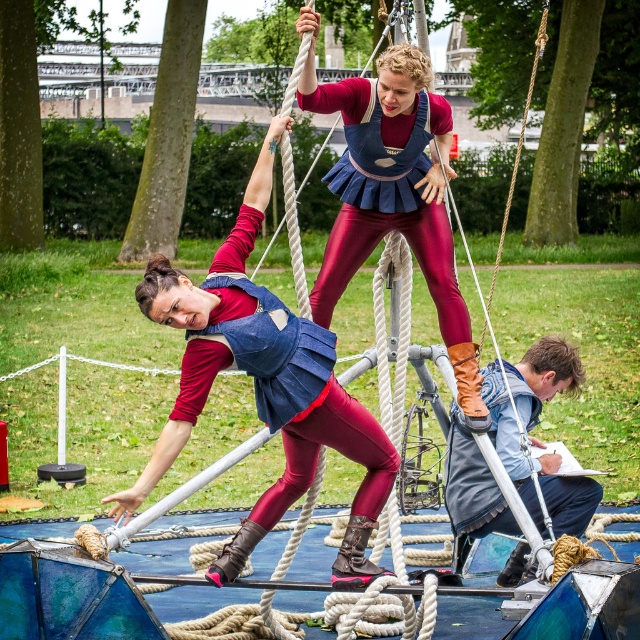
Can you confirm if shiny maroon leggings at center is shorter than denim jacket at lower right?

Incorrect, shiny maroon leggings at center's height does not fall short of denim jacket at lower right's.

Which is behind, point (365, 120) or point (500, 385)?

The point (500, 385) is more distant.

You are a GUI agent. You are given a task and a screenshot of the screen. Output one action in this format:
    pyautogui.click(x=<x>, y=<y>)
    Task: Click on the shiny maroon leggings at center
    
    Given the screenshot: What is the action you would take?
    pyautogui.click(x=392, y=193)

Which of these two, denim vest at center or denim jacket at lower right, stands shorter?

denim jacket at lower right

You are a GUI agent. You are given a task and a screenshot of the screen. Output one action in this format:
    pyautogui.click(x=<x>, y=<y>)
    Task: Click on the denim vest at center
    
    Given the screenshot: What is the action you would take?
    pyautogui.click(x=186, y=355)

This screenshot has height=640, width=640. I want to click on denim vest at center, so click(x=186, y=355).

Does shiny maroon leggings at center have a greater width compared to denim vest at center?

No, shiny maroon leggings at center is not wider than denim vest at center.

Is shiny maroon leggings at center to the left of denim vest at center from the viewer's perspective?

No, shiny maroon leggings at center is not to the left of denim vest at center.

Is point (320, 88) positioned after point (337, 406)?

Yes, it is behind point (337, 406).

Image resolution: width=640 pixels, height=640 pixels. I want to click on shiny maroon leggings at center, so click(x=392, y=193).